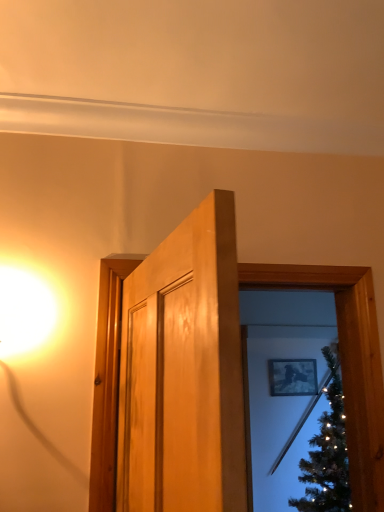
Question: Which direction should I rotate to look at wooden door frame at center, arranged as the 2th window frame when viewed from the front, — up or down?

Choices:
 (A) up
 (B) down

Answer: (B)

Question: Is wooden door at center, marked as the second window frame in a back-to-front arrangement, not inside matte black picture frame at upper center?

Choices:
 (A) yes
 (B) no

Answer: (A)

Question: Could you tell me if wooden door at center, the 1th window frame in the front-to-back sequence, is turned towards matte black picture frame at upper center?

Choices:
 (A) yes
 (B) no

Answer: (B)

Question: Is wooden door at center, the 1th window frame in the front-to-back sequence, facing away from matte black picture frame at upper center?

Choices:
 (A) yes
 (B) no

Answer: (A)

Question: From the image's perspective, is wooden door at center, the 1th window frame in the front-to-back sequence, located beneath matte black picture frame at upper center?

Choices:
 (A) yes
 (B) no

Answer: (B)

Question: From a real-world perspective, does wooden door at center, marked as the second window frame in a back-to-front arrangement, sit lower than matte black picture frame at upper center?

Choices:
 (A) yes
 (B) no

Answer: (B)

Question: Considering the relative positions of wooden door at center, marked as the second window frame in a back-to-front arrangement, and matte black picture frame at upper center in the image provided, is wooden door at center, marked as the second window frame in a back-to-front arrangement, behind matte black picture frame at upper center?

Choices:
 (A) no
 (B) yes

Answer: (A)

Question: Is matte black picture frame at upper center positioned far away from wooden door frame at center, which is counted as the 1th window frame, starting from the back?

Choices:
 (A) yes
 (B) no

Answer: (A)

Question: Considering the relative sizes of matte black picture frame at upper center and wooden door frame at center, which is counted as the 1th window frame, starting from the back, in the image provided, is matte black picture frame at upper center wider than wooden door frame at center, which is counted as the 1th window frame, starting from the back,?

Choices:
 (A) no
 (B) yes

Answer: (A)

Question: Is matte black picture frame at upper center looking in the opposite direction of wooden door frame at center, arranged as the 2th window frame when viewed from the front?

Choices:
 (A) yes
 (B) no

Answer: (B)

Question: From a real-world perspective, is matte black picture frame at upper center on wooden door frame at center, arranged as the 2th window frame when viewed from the front?

Choices:
 (A) no
 (B) yes

Answer: (B)

Question: Is matte black picture frame at upper center directly adjacent to wooden door frame at center, which is counted as the 1th window frame, starting from the back?

Choices:
 (A) yes
 (B) no

Answer: (B)

Question: From a real-world perspective, is matte black picture frame at upper center under wooden door frame at center, arranged as the 2th window frame when viewed from the front?

Choices:
 (A) no
 (B) yes

Answer: (A)

Question: Does wooden door frame at center, arranged as the 2th window frame when viewed from the front, appear on the left side of matte black picture frame at upper center?

Choices:
 (A) yes
 (B) no

Answer: (A)